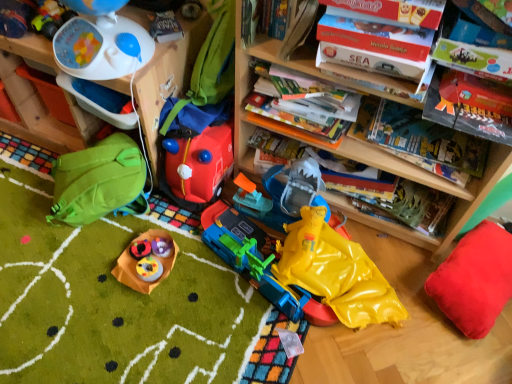
Question: Is white plastic toy at upper left, the 2th toy viewed from the left, in front of hardcover book at upper center, which is the 2th book from back to front?

Choices:
 (A) yes
 (B) no

Answer: (A)

Question: Does white plastic toy at upper left, the 2th toy viewed from the left, have a greater height compared to hardcover book at upper center, which is the 2th book from back to front?

Choices:
 (A) no
 (B) yes

Answer: (B)

Question: From the image's perspective, would you say white plastic toy at upper left, the 2th toy viewed from the left, is positioned over hardcover book at upper center, which is the 5th book in front-to-back order?

Choices:
 (A) yes
 (B) no

Answer: (A)

Question: Is white plastic toy at upper left, acting as the 6th toy starting from the right, not within hardcover book at upper center, which is the 5th book in front-to-back order?

Choices:
 (A) yes
 (B) no

Answer: (A)

Question: Is hardcover book at upper center, which is the 5th book in front-to-back order, at the back of white plastic toy at upper left, acting as the 6th toy starting from the right?

Choices:
 (A) yes
 (B) no

Answer: (B)

Question: Can you confirm if white plastic toy at upper left, the 2th toy viewed from the left, is thinner than hardcover book at upper center, which is the 2th book from back to front?

Choices:
 (A) yes
 (B) no

Answer: (B)

Question: Does wooden bookshelf at upper left turn towards yellow rubber raincoat at lower center, which ranks as the seventh toy in left-to-right order?

Choices:
 (A) no
 (B) yes

Answer: (A)

Question: From a real-world perspective, does wooden bookshelf at upper left sit lower than yellow rubber raincoat at lower center, which is counted as the first toy, starting from the right?

Choices:
 (A) yes
 (B) no

Answer: (B)

Question: Is wooden bookshelf at upper left smaller than yellow rubber raincoat at lower center, which ranks as the seventh toy in left-to-right order?

Choices:
 (A) no
 (B) yes

Answer: (A)

Question: Considering the relative positions of wooden bookshelf at upper left and yellow rubber raincoat at lower center, which is counted as the first toy, starting from the right, in the image provided, is wooden bookshelf at upper left in front of yellow rubber raincoat at lower center, which is counted as the first toy, starting from the right,?

Choices:
 (A) no
 (B) yes

Answer: (A)

Question: Can you confirm if wooden bookshelf at upper left is bigger than yellow rubber raincoat at lower center, which ranks as the seventh toy in left-to-right order?

Choices:
 (A) yes
 (B) no

Answer: (A)

Question: Is wooden bookshelf at upper left not within yellow rubber raincoat at lower center, which is counted as the first toy, starting from the right?

Choices:
 (A) yes
 (B) no

Answer: (A)

Question: Is wooden bookcase at upper center smaller than matte plastic cupcakes at center, which appears as the 5th toy when viewed from the left?

Choices:
 (A) no
 (B) yes

Answer: (A)